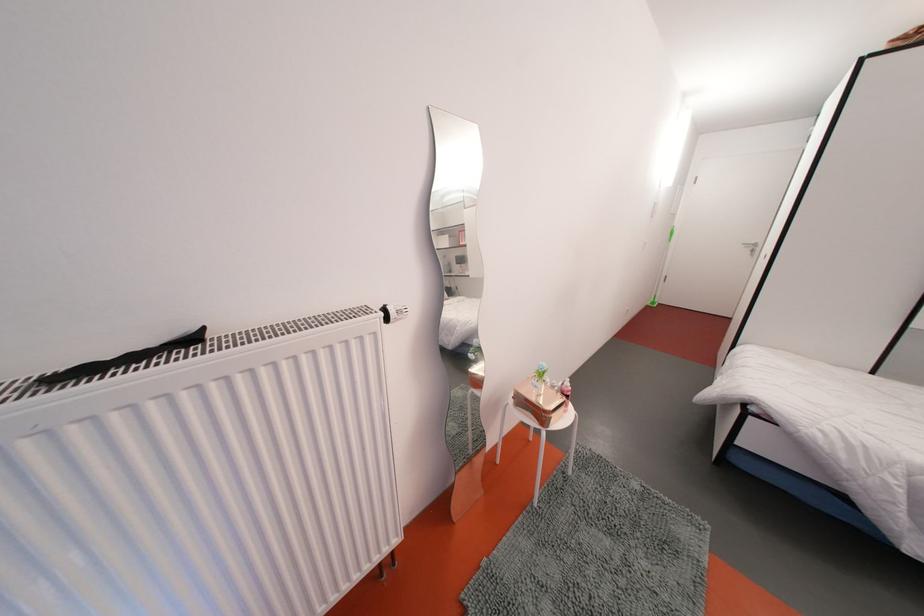
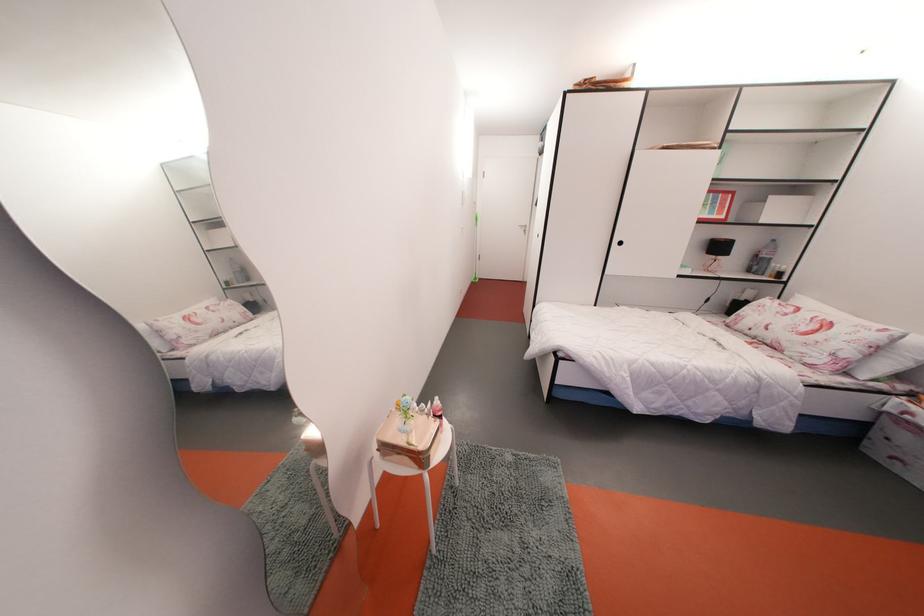
Locate, in the second image, the point that corresponds to the point at 565,397 in the first image.

(435, 419)